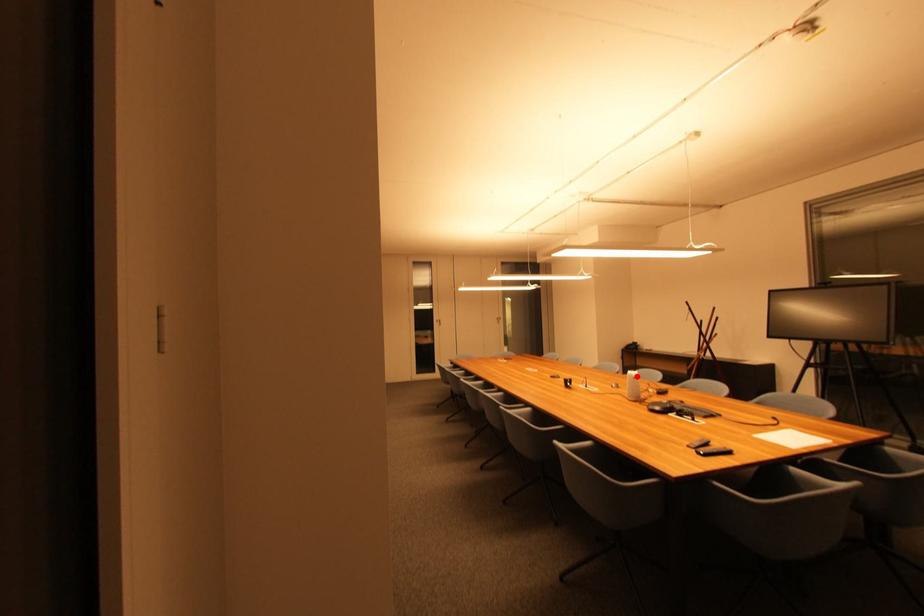
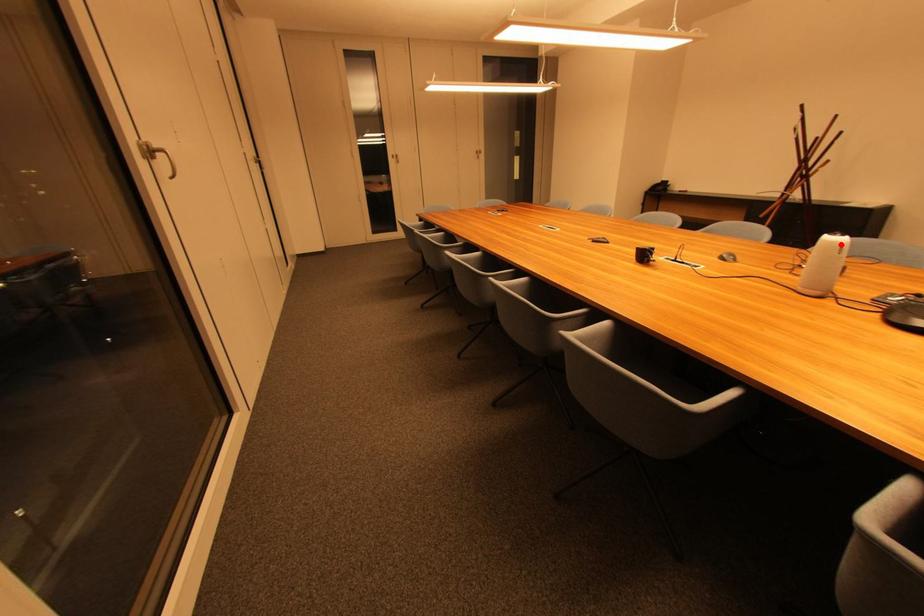
I am providing you with two images of the same scene from different viewpoints. A red point is marked on the first image and another point is marked on the second image. Is the marked point in image1 the same physical position as the marked point in image2?

Yes